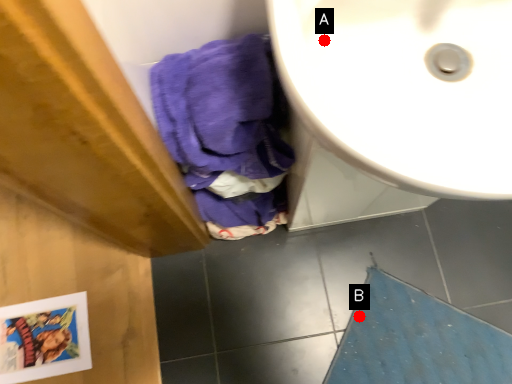
Question: Two points are circled on the image, labeled by A and B beside each circle. Which of the following is the closest to the observer?

Choices:
 (A) A is closer
 (B) B is closer

Answer: (A)